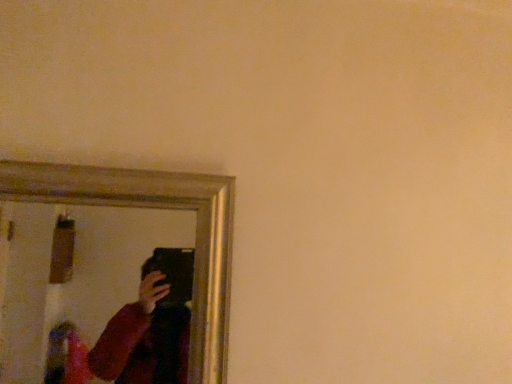
What do you see at coordinates (75, 275) in the screenshot?
I see `gold metallic mirror at left` at bounding box center [75, 275].

Where is `gold metallic mirror at left`? gold metallic mirror at left is located at coordinates (75, 275).

Where is `gold metallic mirror at left`? This screenshot has height=384, width=512. gold metallic mirror at left is located at coordinates (75, 275).